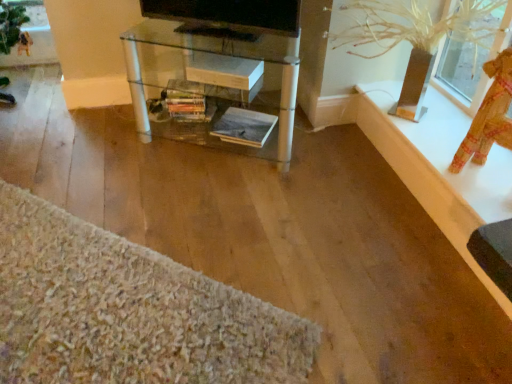
The width and height of the screenshot is (512, 384). I want to click on free space that is in between clear glass table at center and textured beige rug at lower left, so click(188, 198).